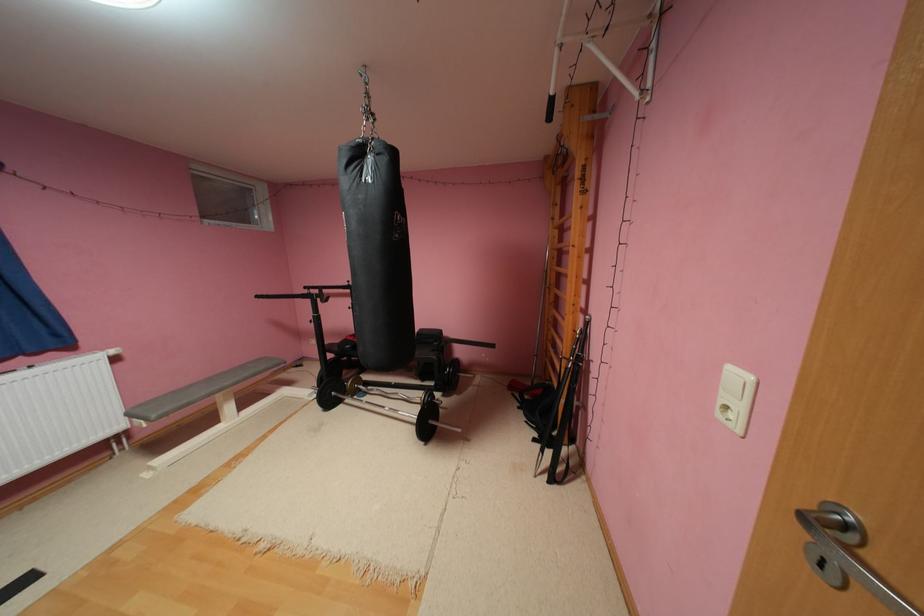
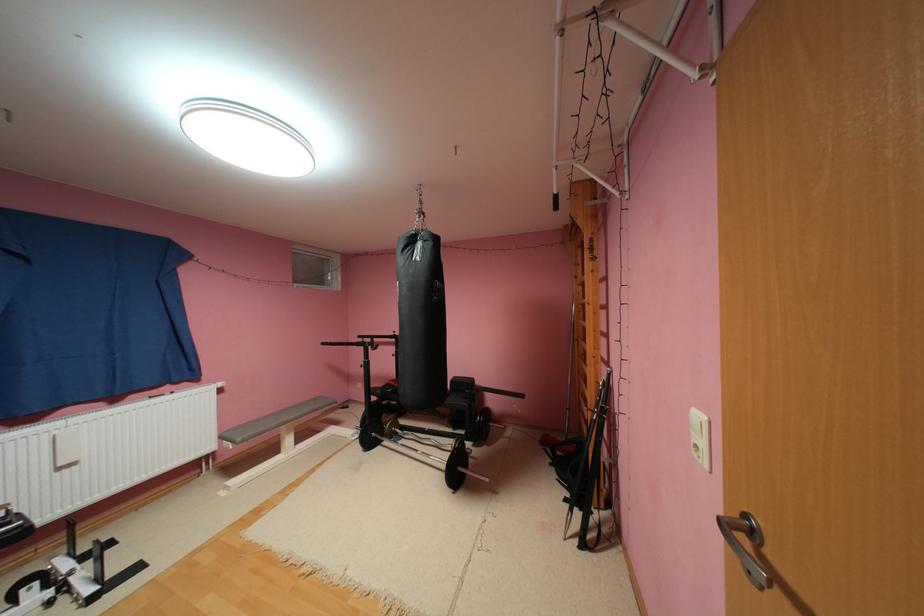
Find the pixel in the second image that matches (x=236, y=383) in the first image.

(300, 416)